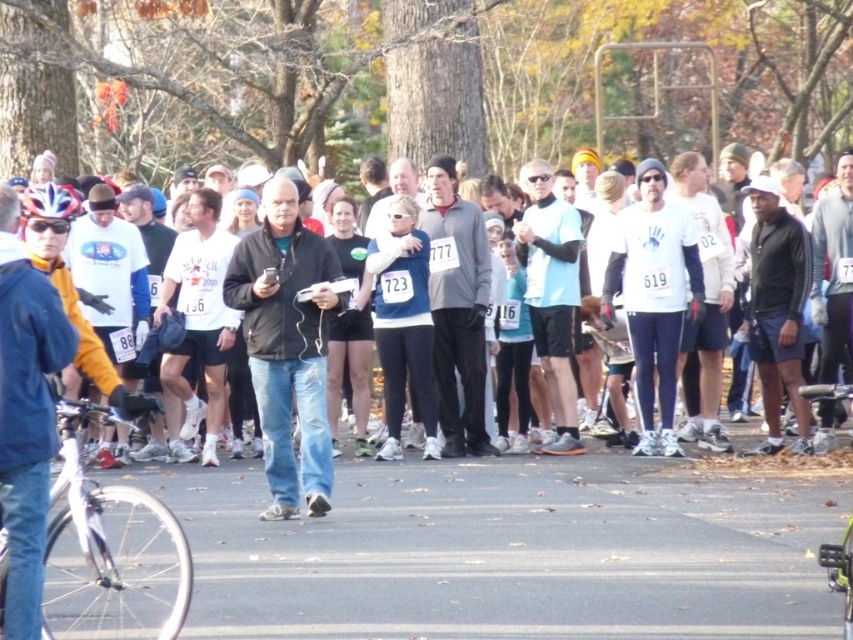
Consider the image. You are standing at the center of the image and want to take a photo of the white matte bicycle at lower left. In which direction should you move to get a better shot?

The white matte bicycle at lower left is located at point (109, 552), so you should move towards the lower left direction to get a better shot.

You are a photographer standing in the scene and want to take a photo of both the white matte bicycle at lower left and the green matte bicycle at lower right. Which bicycle should you focus on first if you want to capture them both in the frame without moving your camera?

You should focus on the white matte bicycle at lower left first because it is shorter than the green matte bicycle at lower right, allowing you to adjust your camera angle to include both in the frame.